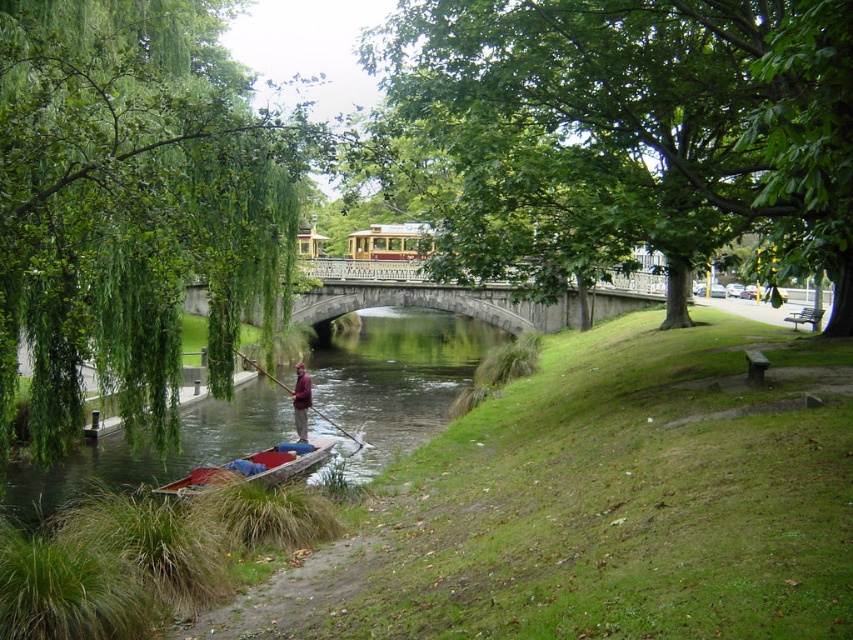
Is green leafy tree at center below brown wooden boat at lower left?

Actually, green leafy tree at center is above brown wooden boat at lower left.

Is green leafy tree at center shorter than brown wooden boat at lower left?

No, green leafy tree at center is not shorter than brown wooden boat at lower left.

Is point (596, 1) farther from viewer compared to point (79, 454)?

No, it is not.

Identify the location of green leafy tree at center. (631, 129).

Can you confirm if wooden canoe at lower left is shorter than wooden at center?

Yes, wooden canoe at lower left is shorter than wooden at center.

Consider the image. Is wooden canoe at lower left taller than wooden at center?

Incorrect, wooden canoe at lower left's height is not larger of wooden at center's.

Where is `wooden canoe at lower left`? wooden canoe at lower left is located at coordinates point(253,467).

In order to click on wooden canoe at lower left in this screenshot , I will do `click(253, 467)`.

Does green leafy tree at center lie in front of maroon fabric shirt at center?

Yes, it is in front of maroon fabric shirt at center.

Does green leafy tree at center have a lesser height compared to maroon fabric shirt at center?

Incorrect, green leafy tree at center's height does not fall short of maroon fabric shirt at center's.

Locate an element on the screen. green leafy tree at center is located at coordinates (631, 129).

I want to click on green leafy tree at center, so click(631, 129).